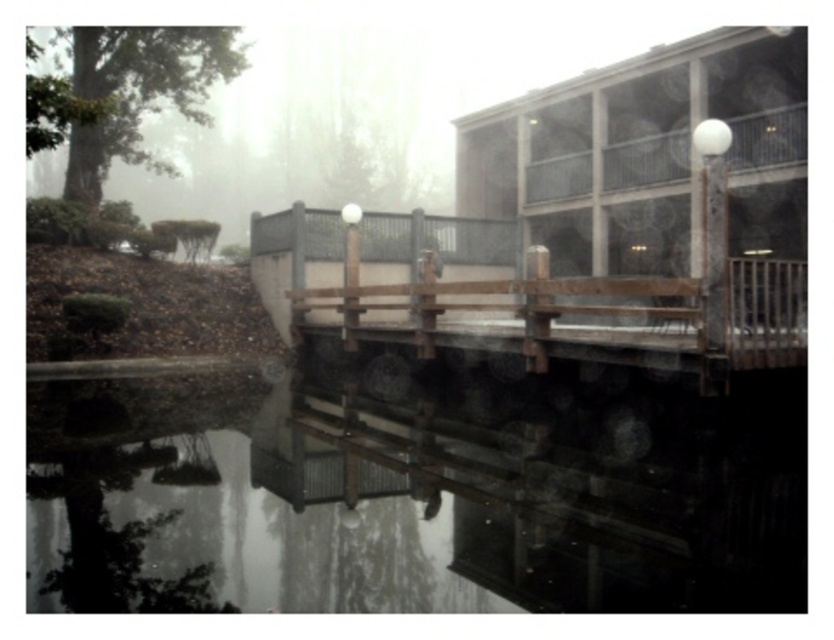
Does transparent water at center lie behind wooden bench at center?

No, it is in front of wooden bench at center.

Between point (43, 474) and point (510, 339), which one is positioned behind?

Point (510, 339)

Describe the element at coordinates (407, 499) in the screenshot. The height and width of the screenshot is (640, 834). I see `transparent water at center` at that location.

This screenshot has width=834, height=640. In order to click on transparent water at center in this screenshot , I will do `click(407, 499)`.